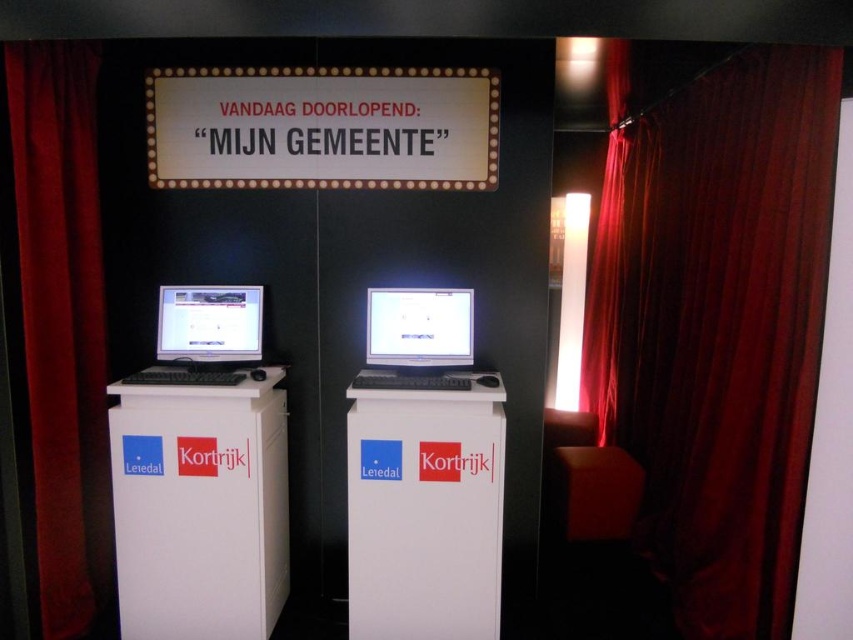
Based on the photo, is velvet dark red curtain at right wider than matte black monitor at center?

No, velvet dark red curtain at right is not wider than matte black monitor at center.

Looking at this image, does velvet dark red curtain at right have a lesser height compared to matte black monitor at center?

Incorrect, velvet dark red curtain at right's height does not fall short of matte black monitor at center's.

Find the location of `velvet dark red curtain at right`. velvet dark red curtain at right is located at coordinates (717, 326).

Where is `velvet dark red curtain at right`? The height and width of the screenshot is (640, 853). velvet dark red curtain at right is located at coordinates (717, 326).

Between velvet dark red curtain at right and matte white monitor at left, which one is positioned lower?

matte white monitor at left is lower down.

Does velvet dark red curtain at right have a greater height compared to matte white monitor at left?

Yes, velvet dark red curtain at right is taller than matte white monitor at left.

Where is `velvet dark red curtain at right`? The height and width of the screenshot is (640, 853). velvet dark red curtain at right is located at coordinates (717, 326).

Who is shorter, velvet red curtain at left or matte white monitor at left?

With less height is matte white monitor at left.

Where is `velvet red curtain at left`? The height and width of the screenshot is (640, 853). velvet red curtain at left is located at coordinates (61, 317).